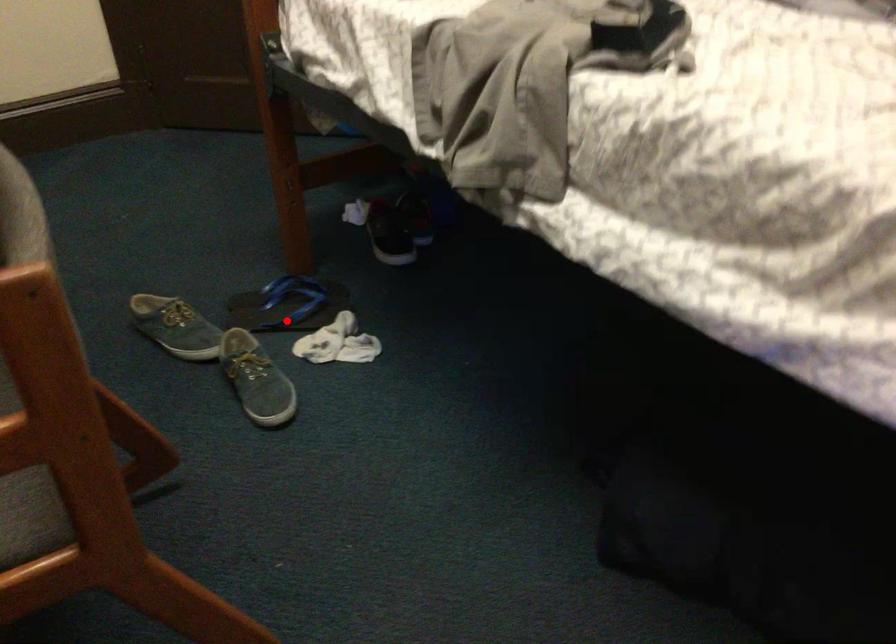
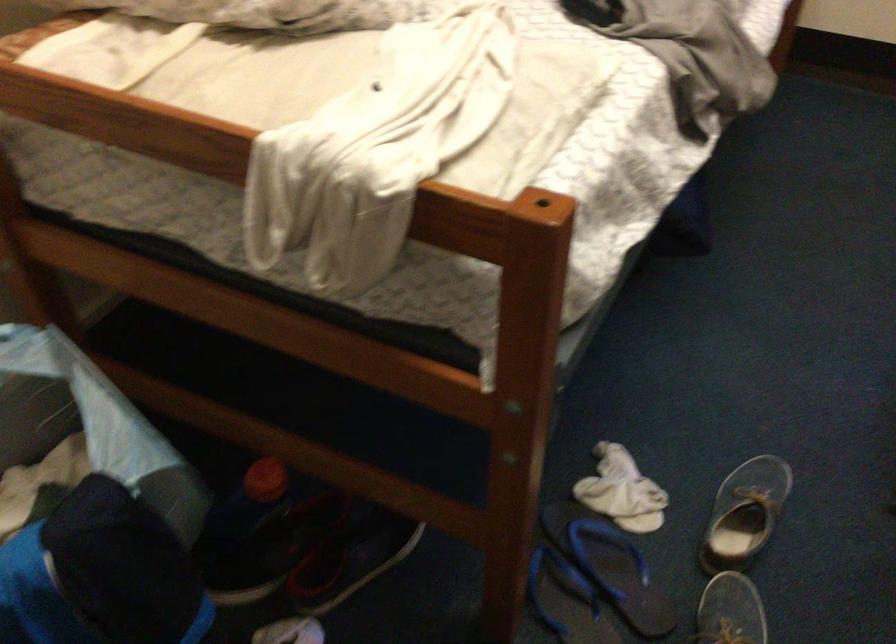
Question: I am providing you with two images of the same scene from different viewpoints. Image1 has a red point marked. In image2, the corresponding 3D location appears at what relative position? Reply with the corresponding letter.

Choices:
 (A) Closer
 (B) Farther

Answer: (A)